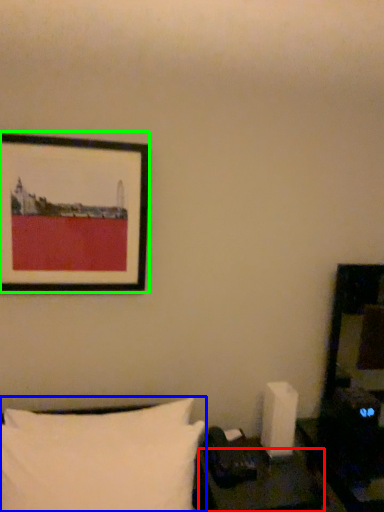
Question: Which object is positioned farthest from table (highlighted by a red box)? Select from pillow (highlighted by a blue box) and picture frame (highlighted by a green box).

Choices:
 (A) pillow
 (B) picture frame

Answer: (B)